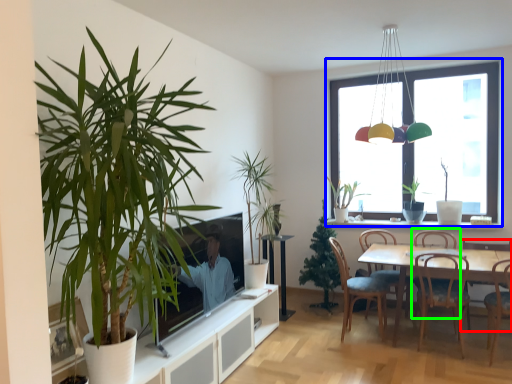
Question: Considering the real-world distances, which object is closest to chair (highlighted by a red box)? window (highlighted by a blue box) or armchair (highlighted by a green box).

Choices:
 (A) window
 (B) armchair

Answer: (B)